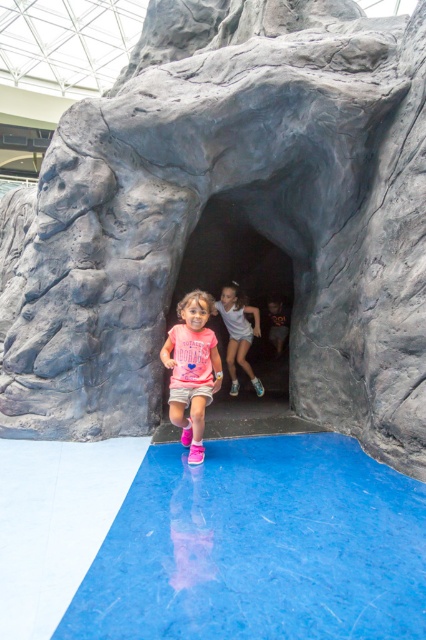
Looking at this image, you are a parent trying to decide which clothing item to choose for your child to play in the cave area. You see the pink matte shorts at center and the white cotton dress at center. Which clothing item is more suitable for crawling through narrow spaces?

The pink matte shorts at center is thinner than the white cotton dress at center, making it more suitable for crawling through narrow spaces.

You are standing in front of the cave and want to take a photo. You notice two points marked in the scene. The first point is at coordinates point (178, 333) and the second is at point (230, 326). Which point is closer to your camera?

Point (178, 333) is closer to the camera than point (230, 326).

You are a parent trying to locate your child in the play area. You see the bright blue floor and the artificial rock cave entrance. Where exactly is the pink matte shorts at center located in relation to the cave entrance and the blue floor?

The pink matte shorts at center is located at point coordinates of 0.578 on the x axis and 0.451 on the y axis, which is at the center of the image between the cave entrance and the blue floor.